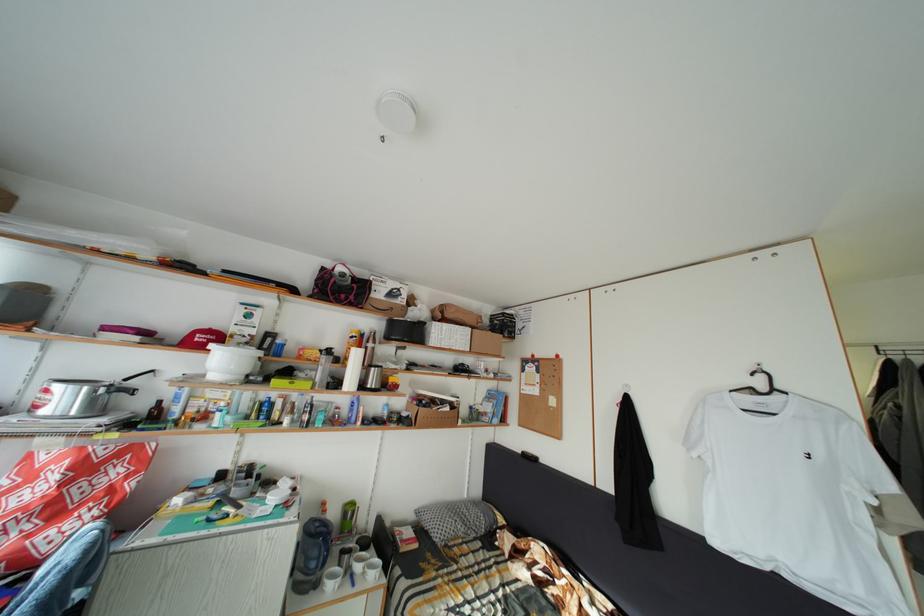
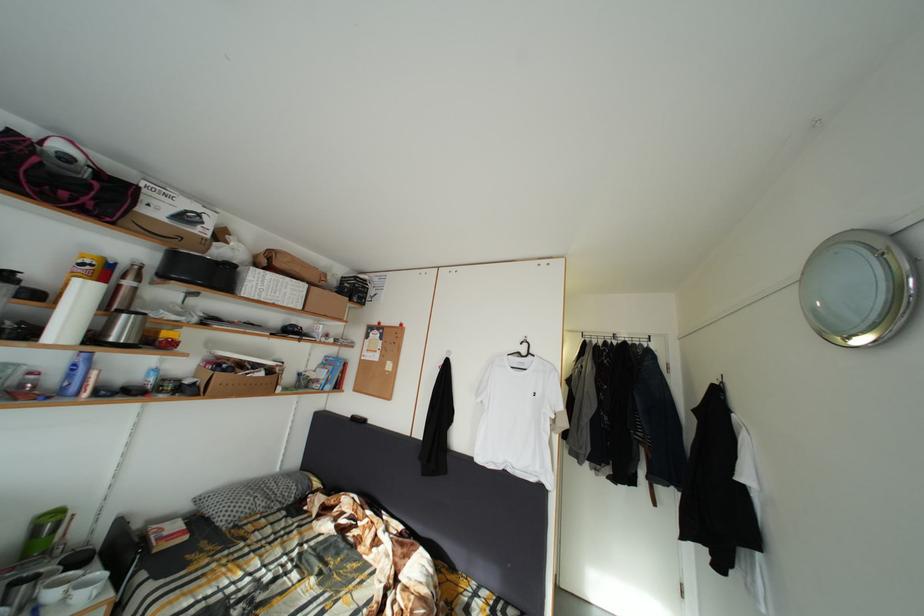
Where in the second image is the point corresponding to [452,408] from the first image?

(264, 373)